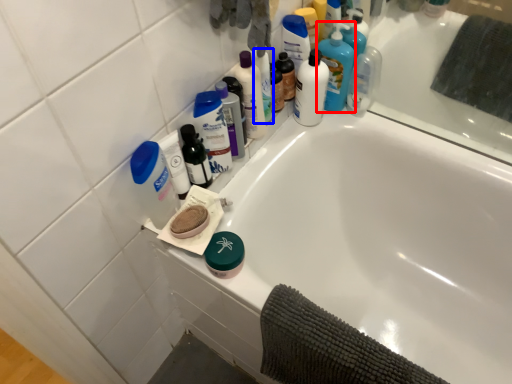
Question: Among these objects, which one is nearest to the camera, cleaning product (highlighted by a red box) or cleaning product (highlighted by a blue box)?

Choices:
 (A) cleaning product
 (B) cleaning product

Answer: (B)